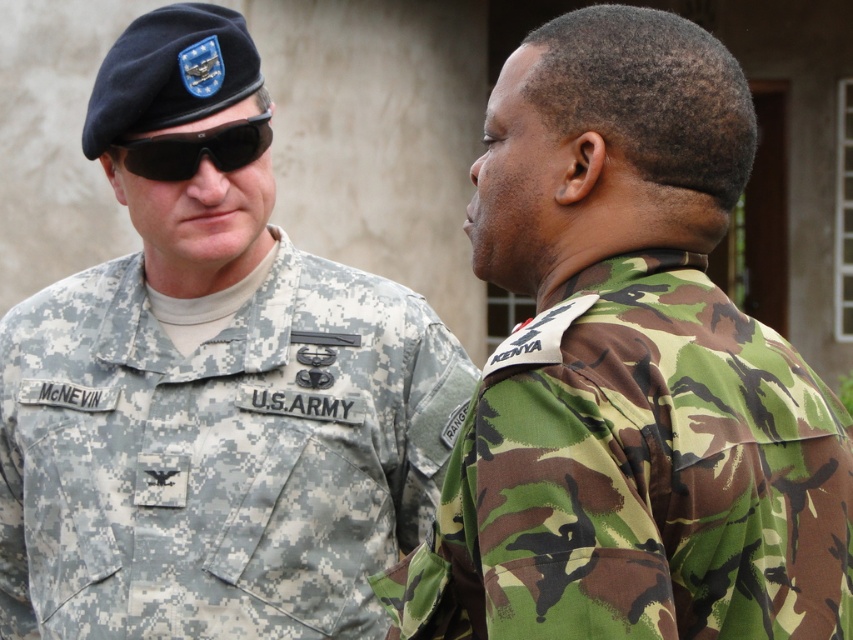
Question: Which point appears farthest from the camera in this image?

Choices:
 (A) (171, 140)
 (B) (689, 317)

Answer: (A)

Question: Is camouflage fabric uniform at right wider than black matte goggles at upper left?

Choices:
 (A) yes
 (B) no

Answer: (A)

Question: Estimate the real-world distances between objects in this image. Which object is closer to the black matte goggles at upper left?

Choices:
 (A) camouflage fabric uniform at right
 (B) digital camouflage uniform at left

Answer: (B)

Question: Does camouflage fabric uniform at right have a greater width compared to digital camouflage uniform at left?

Choices:
 (A) yes
 (B) no

Answer: (B)

Question: Which point is farther from the camera taking this photo?

Choices:
 (A) (839, 500)
 (B) (27, 620)
 (C) (260, 116)

Answer: (B)

Question: Can you confirm if digital camouflage uniform at left is positioned to the left of black matte goggles at upper left?

Choices:
 (A) yes
 (B) no

Answer: (A)